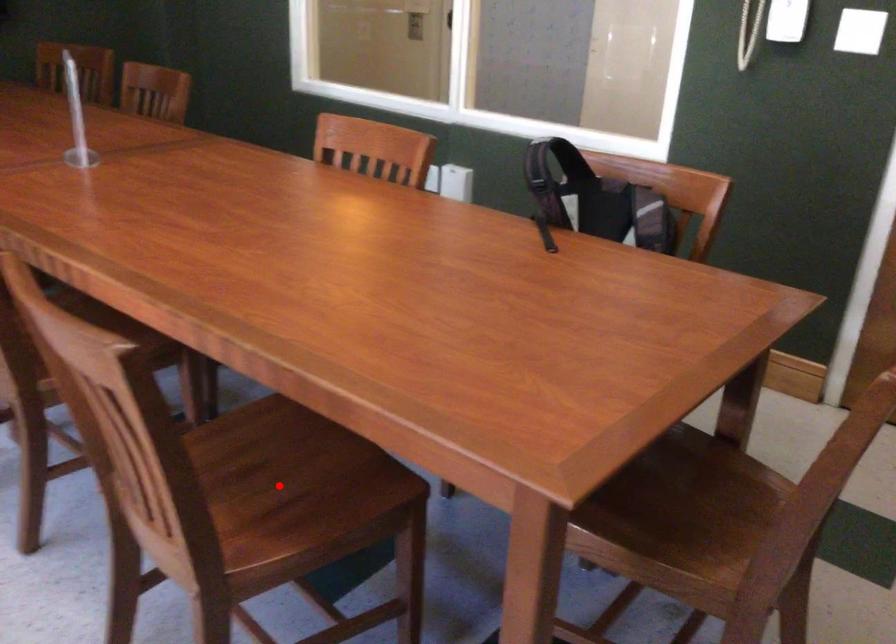
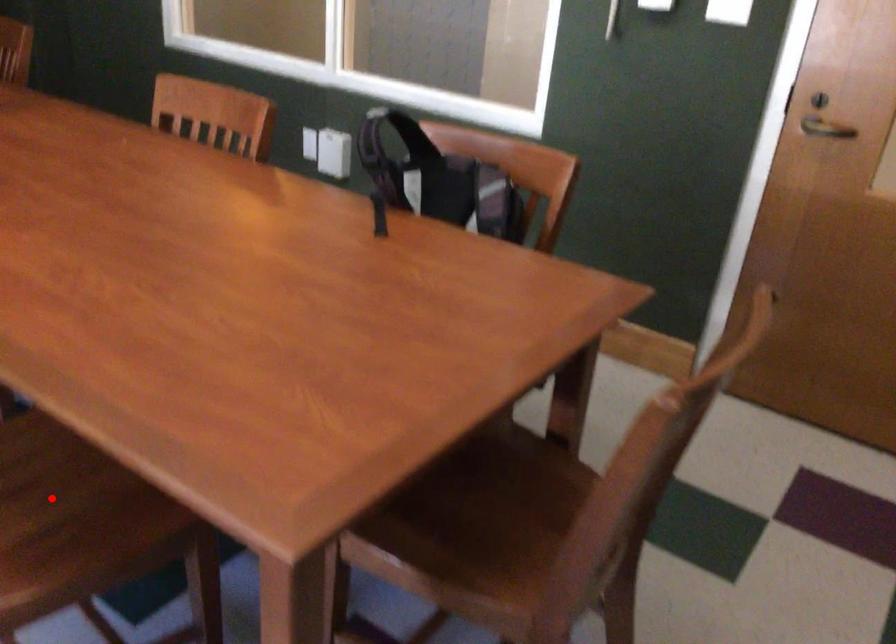
I am providing you with two images of the same scene from different viewpoints. A red point is marked on the first image and another point is marked on the second image. Do the highlighted points in image1 and image2 indicate the same real-world spot?

Yes